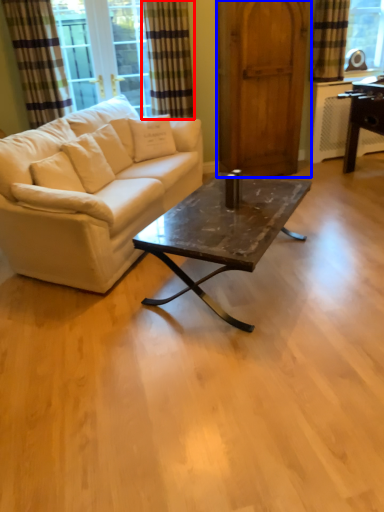
Question: Which of the following is the closest to the observer, curtain (highlighted by a red box) or barn door (highlighted by a blue box)?

Choices:
 (A) curtain
 (B) barn door

Answer: (B)